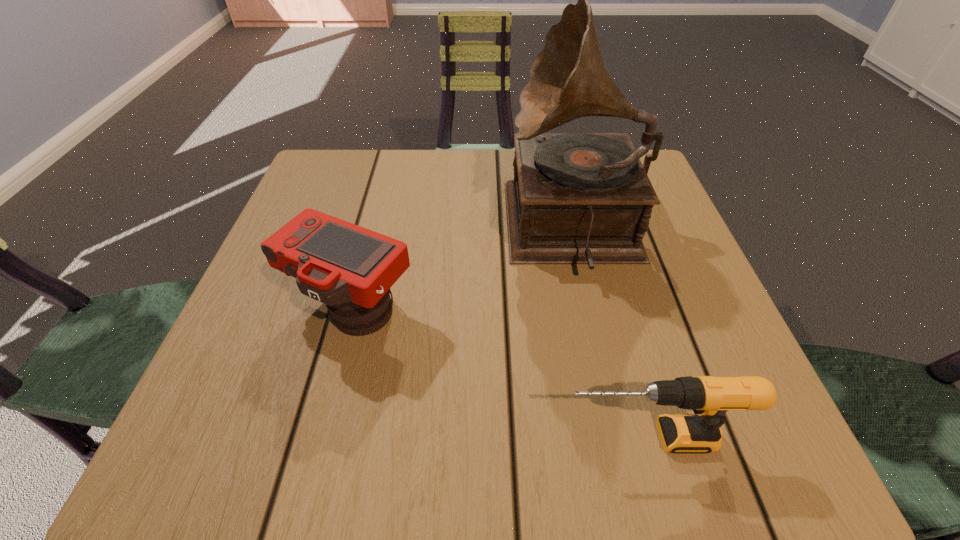
The height and width of the screenshot is (540, 960). In the image, there is a desktop. Find the location of `vacant space at the right edge`. vacant space at the right edge is located at coordinates (618, 281).

Find the location of a particular element. This screenshot has height=540, width=960. free space at the far left corner of the desktop is located at coordinates (321, 162).

The image size is (960, 540). Find the location of `vacant space at the near left corner`. vacant space at the near left corner is located at coordinates (229, 416).

You are a GUI agent. You are given a task and a screenshot of the screen. Output one action in this format:
    pyautogui.click(x=<x>, y=<y>)
    Task: Click on the unoccupied position between the camera and the drill
    
    Given the screenshot: What is the action you would take?
    pyautogui.click(x=500, y=373)

The image size is (960, 540). I want to click on free spot between the tallest object and the nearest object, so click(x=611, y=333).

The image size is (960, 540). In order to click on free area in between the nearest object and the leftmost object in this screenshot , I will do `click(500, 373)`.

The image size is (960, 540). Identify the location of vacant space that's between the drill and the tallest object. (611, 333).

The width and height of the screenshot is (960, 540). In order to click on vacant area that lies between the drill and the camera in this screenshot , I will do `click(500, 373)`.

Locate an element on the screen. The image size is (960, 540). vacant space in between the tallest object and the nearest object is located at coordinates (611, 333).

Locate an element on the screen. vacant area that lies between the tallest object and the drill is located at coordinates (611, 333).